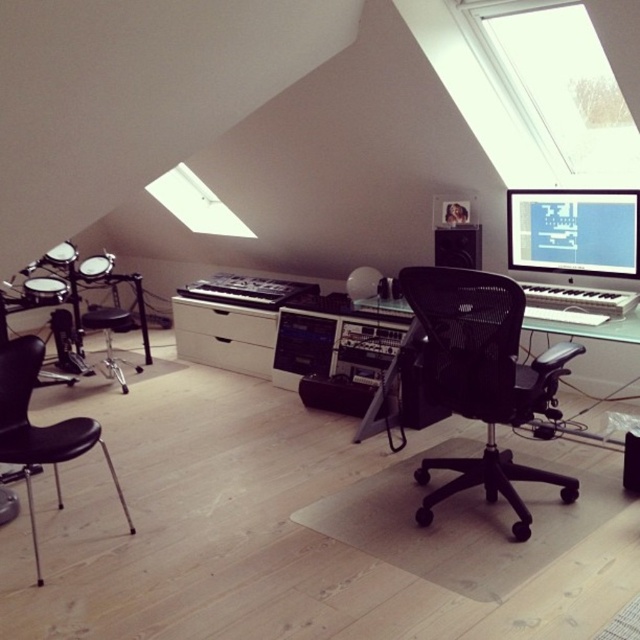
You are a musician entering the studio and need to sit at the desk. Where is the black mesh office chair at center in relation to the electronic drum set with black components and silver hardware?

The black mesh office chair at center is located at point (483, 378), which is to the right of the electronic drum set with black components and silver hardware positioned on the left side of the image.

You are a sound engineer standing at the entrance of the music studio and need to adjust the microphone stand placed near the black leather swivel chair at left. If your reach extends 1.8 meters, can you reach the microphone stand without moving from your current position?

The black leather swivel chair at left is 2.36 meters away from you. Since your reach is only 1.8 meters, you cannot reach the microphone stand placed near the black leather swivel chair at left without moving closer.

You are a musician who wants to sit in the black leather swivel chair at left while accessing the white matte drawer at center. Can you reach the drawer from the chair without moving your chair?

The black leather swivel chair at left is positioned under the white matte drawer at center, so yes, the musician can likely reach the drawer from the chair without moving it since it is directly beneath it.